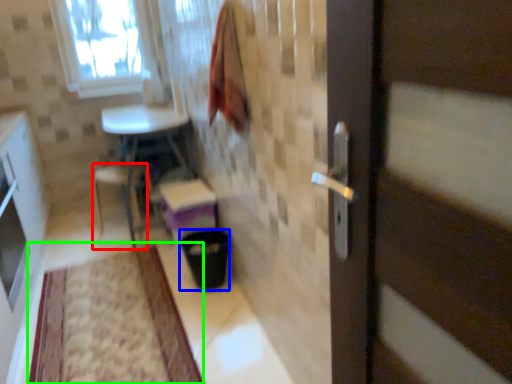
Question: Which object is the farthest from chair (highlighted by a red box)? Choose among these: trash bin/can (highlighted by a blue box) or mat (highlighted by a green box).

Choices:
 (A) trash bin/can
 (B) mat

Answer: (B)